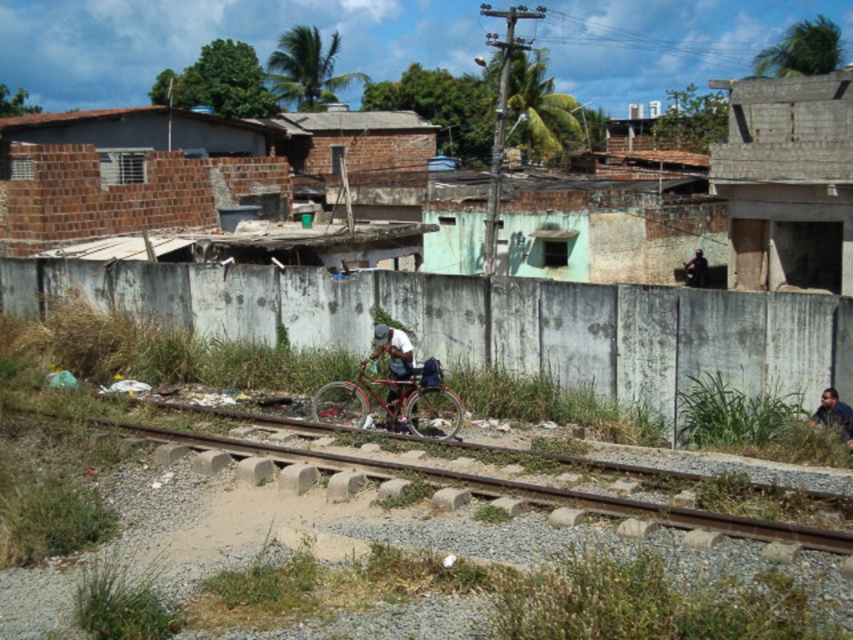
Between metallic bicycle at center and dark blue fabric shirt at lower right, which one has more height?

metallic bicycle at center

Does metallic bicycle at center have a smaller size compared to dark blue fabric shirt at lower right?

Incorrect, metallic bicycle at center is not smaller in size than dark blue fabric shirt at lower right.

Does point (401, 333) come in front of point (833, 412)?

That is False.

Where is `metallic bicycle at center`? The width and height of the screenshot is (853, 640). metallic bicycle at center is located at coordinates (393, 349).

Can you confirm if metallic bicycle at center is smaller than dark blue fabric bag at center?

Correct, metallic bicycle at center occupies less space than dark blue fabric bag at center.

Does metallic bicycle at center have a larger size compared to dark blue fabric bag at center?

No.

At what (x,y) coordinates should I click in order to perform the action: click on metallic bicycle at center. Please return your answer as a coordinate pair (x, y). Looking at the image, I should click on (393, 349).

Based on the photo, is metallic red bicycle at center to the right of metallic bicycle at center from the viewer's perspective?

Yes, metallic red bicycle at center is to the right of metallic bicycle at center.

Between metallic red bicycle at center and metallic bicycle at center, which one appears on the left side from the viewer's perspective?

From the viewer's perspective, metallic bicycle at center appears more on the left side.

Is point (387, 413) positioned behind point (383, 349)?

Yes, it is.

Locate an element on the screen. The width and height of the screenshot is (853, 640). metallic red bicycle at center is located at coordinates (392, 401).